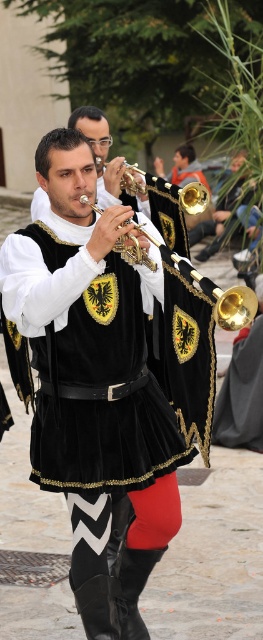
Is gold polished trumpet at center shorter than gold shiny trumpet at upper center?

Incorrect, gold polished trumpet at center's height does not fall short of gold shiny trumpet at upper center's.

Between gold polished trumpet at center and gold shiny trumpet at upper center, which one appears on the right side from the viewer's perspective?

Positioned to the right is gold shiny trumpet at upper center.

Is point (220, 301) behind point (198, 180)?

No, (220, 301) is in front of (198, 180).

Locate an element on the screen. This screenshot has width=263, height=640. gold polished trumpet at center is located at coordinates (234, 307).

Is gold metallic trumpet at center wider than gold shiny trumpet at center?

Incorrect, gold metallic trumpet at center's width does not surpass gold shiny trumpet at center's.

Between gold metallic trumpet at center and gold shiny trumpet at center, which one has less height?

Standing shorter between the two is gold metallic trumpet at center.

The width and height of the screenshot is (263, 640). What are the coordinates of `gold metallic trumpet at center` in the screenshot? It's located at (122, 179).

Between velvet black trumpet at center and gold shiny trumpet at center, which one has less height?

Standing shorter between the two is gold shiny trumpet at center.

From the picture: Is velvet black trumpet at center to the left of gold shiny trumpet at center from the viewer's perspective?

Indeed, velvet black trumpet at center is positioned on the left side of gold shiny trumpet at center.

Does point (140, 416) come behind point (139, 244)?

Yes.

In order to click on velvet black trumpet at center in this screenshot , I will do click(x=94, y=381).